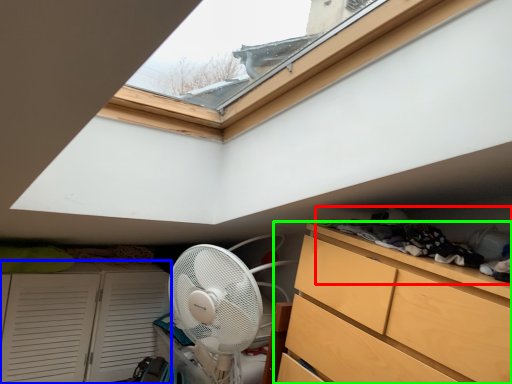
Question: Which object is the farthest from laundry (highlighted by a red box)? Choose among these: cupboard (highlighted by a blue box) or chest of drawers (highlighted by a green box).

Choices:
 (A) cupboard
 (B) chest of drawers

Answer: (A)